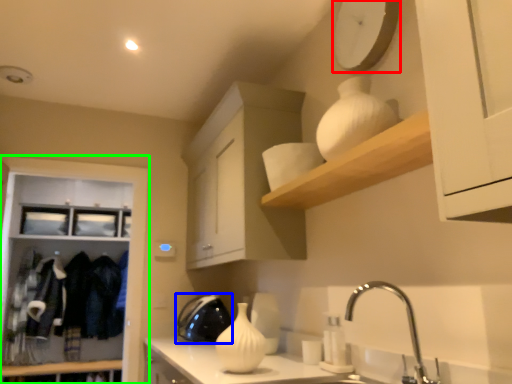
Question: Estimate the real-world distances between objects in this image. Which object is closer to clock (highlighted by a red box), appliance (highlighted by a blue box) or cabinetry (highlighted by a green box)?

Choices:
 (A) appliance
 (B) cabinetry

Answer: (A)